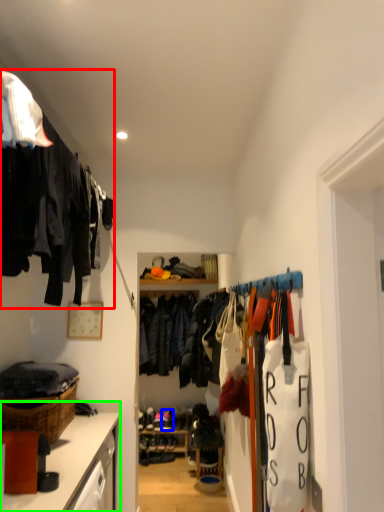
Question: Based on their relative distances, which object is nearer to closet (highlighted by a red box)? Choose from footwear (highlighted by a blue box) and cabinetry (highlighted by a green box).

Choices:
 (A) footwear
 (B) cabinetry

Answer: (B)